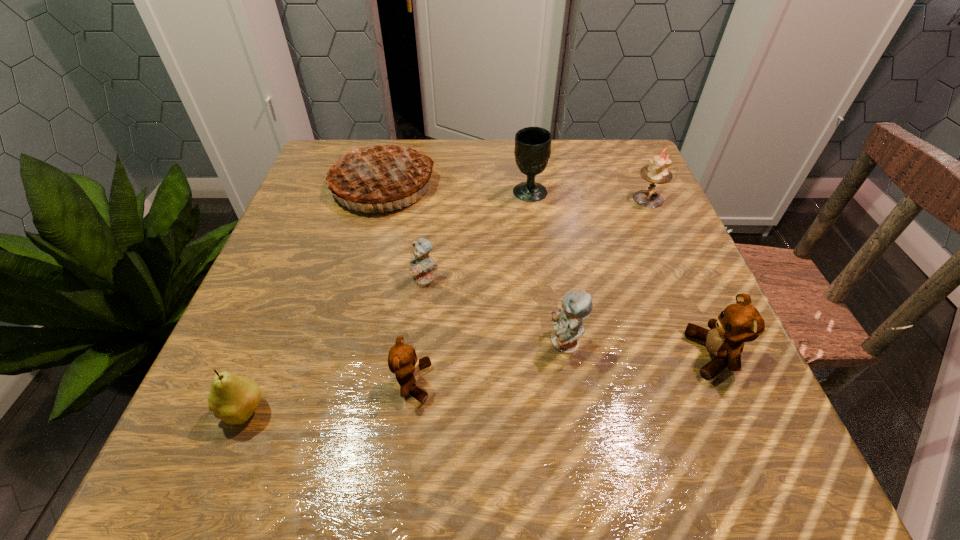
Identify the location of the tallest object. (376, 172).

Find the location of a particular element. chalice is located at coordinates pyautogui.click(x=532, y=151).

Locate an element on the screen. This screenshot has width=960, height=540. candle holder is located at coordinates (657, 172).

At what (x,y) coordinates should I click in order to perform the action: click on the bigger blue teddy bear. Please return your answer as a coordinate pair (x, y). The image size is (960, 540). Looking at the image, I should click on (576, 306).

Find the location of a particular element. The image size is (960, 540). the right blue teddy bear is located at coordinates (576, 306).

Find the location of a particular element. The height and width of the screenshot is (540, 960). the bigger brown teddy bear is located at coordinates (741, 322).

This screenshot has width=960, height=540. I want to click on the rightmost teddy bear, so click(x=741, y=322).

What are the coordinates of `pear` in the screenshot? It's located at (233, 399).

Where is `the smaller blue teddy bear`? The height and width of the screenshot is (540, 960). the smaller blue teddy bear is located at coordinates (422, 265).

Find the location of `the fourth farthest object`. the fourth farthest object is located at coordinates (422, 265).